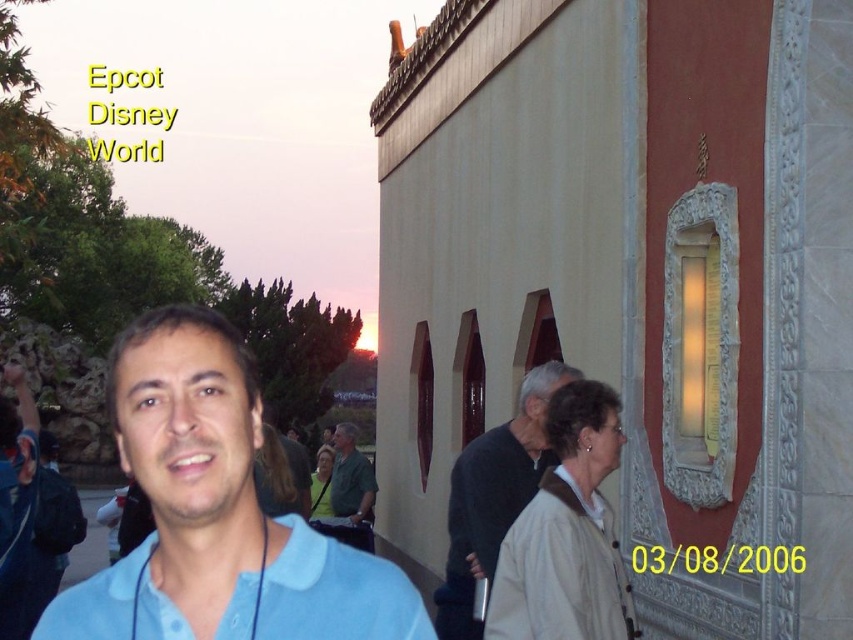
You are a photographer at Epcot Disney World on 03.8.2006. You need to capture a group photo of two people wearing a light blue cotton shirt at center and a beige cotton polo shirt at center. Which shirt will appear bigger in the photo?

The light blue cotton shirt at center will appear bigger in the photo because it is larger in size than the beige cotton polo shirt at center.

You are taking a photo of two people wearing different colored clothing at Epcot Disney World. The person in the dark gray sweater at center is standing behind the person in the green fabric shirt at center. Can you tell me which clothing item is taller?

The dark gray sweater at center is much taller than the green fabric shirt at center.

You are standing at the Epcot Disney World on 03.08.2006 during sunset. You see a man in a light blue shirt and a lanyard. There is a dark gray sweater at center located at point (492, 497). Can you determine the spatial relationship between the man in the light blue shirt and the dark gray sweater at center?

The dark gray sweater at center is located at point (492, 497), but the exact position of the man in the light blue shirt is not provided in the description. Therefore, it is impossible to determine their spatial relationship based on the given information.